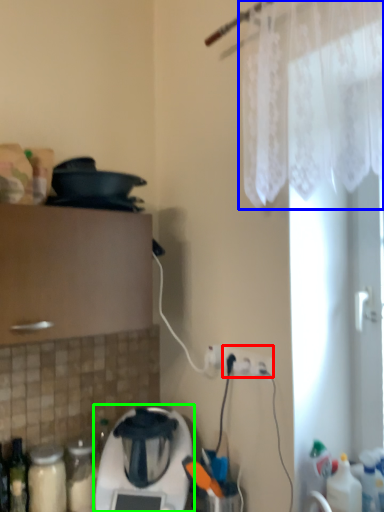
Question: Based on their relative distances, which object is farther from electric outlet (highlighted by a red box)? Choose from curtain (highlighted by a blue box) and home appliance (highlighted by a green box).

Choices:
 (A) curtain
 (B) home appliance

Answer: (A)